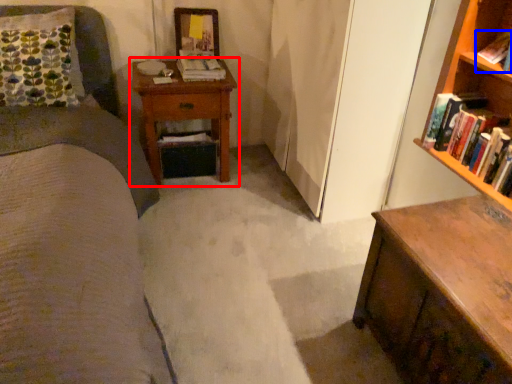
Question: Which of the following is the farthest to the observer, nightstand (highlighted by a red box) or book (highlighted by a blue box)?

Choices:
 (A) nightstand
 (B) book

Answer: (A)